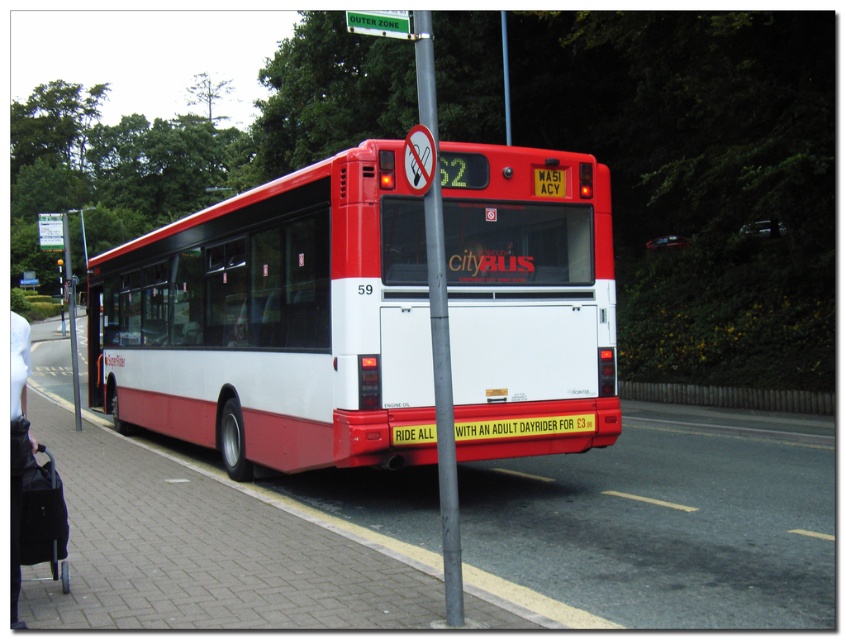
Looking at this image, you are a delivery person trying to park your van behind the bus. The van requires a parking space that is at least as tall as the brick pavement at lower left. Can the yellowtexturedlicense plate at center fit in this space?

The brick pavement at lower left is taller than the yellowtexturedlicense plate at center, so the yellowtexturedlicense plate at center cannot fit in the parking space that needs to be at least as tall as the brick pavement at lower left.

You are a pedestrian standing on the sidewalk and want to cross the street to the bus stop. Which object is closer to you, the brick pavement at lower left or the yellowtexturedlicense plate at center?

The brick pavement at lower left is closer to you since it is positioned under the yellowtexturedlicense plate at center, meaning it is lower in the image and thus closer to the observer.

You are a pedestrian standing on the sidewalk. You see the red matte bus at center and the brick pavement at lower left. Which surface are you currently standing on?

The brick pavement at lower left is the surface you are standing on since the red matte bus at center is positioned over it.